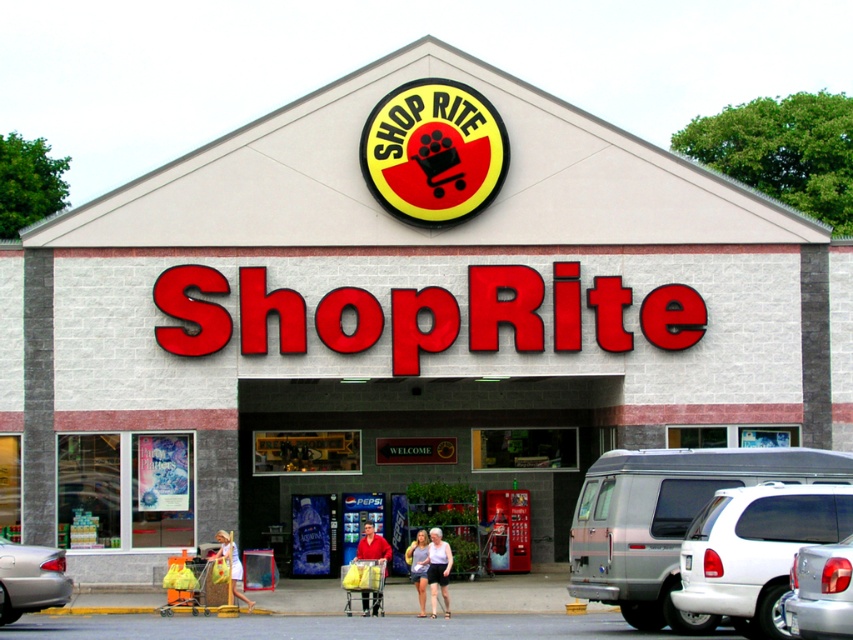
Question: In this image, where is silver metallic van at center located relative to red cotton shirt at center?

Choices:
 (A) below
 (B) above

Answer: (B)

Question: Among these points, which one is nearest to the camera?

Choices:
 (A) (703, 545)
 (B) (418, 582)

Answer: (A)

Question: Which object is the farthest from the white cotton shirt at center?

Choices:
 (A) white matte suv at lower right
 (B) silver metallic van at center
 (C) silver metallic sedan at lower left

Answer: (B)

Question: Which object is farther from the camera taking this photo?

Choices:
 (A) red cotton shirt at center
 (B) silver metallic sedan at lower left
 (C) white cotton dress at center
 (D) white matte suv at lower right

Answer: (A)

Question: Does silver metallic sedan at lower left have a smaller size compared to light blue denim shorts at center?

Choices:
 (A) yes
 (B) no

Answer: (B)

Question: Is white matte suv at lower right to the left of silver metallic sedan at lower left from the viewer's perspective?

Choices:
 (A) no
 (B) yes

Answer: (A)